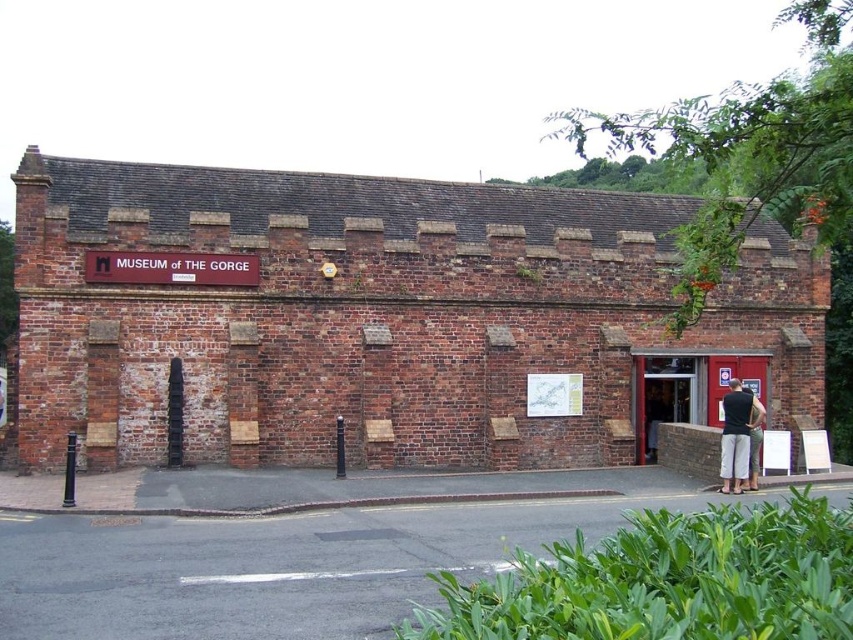
Question: Does light gray pants at center appear on the right side of dark gray fabric pants at lower right?

Choices:
 (A) yes
 (B) no

Answer: (B)

Question: Which object appears closest to the camera in this image?

Choices:
 (A) light gray pants at center
 (B) dark gray fabric pants at lower right

Answer: (A)

Question: Can you confirm if light gray pants at center is positioned above dark gray fabric pants at lower right?

Choices:
 (A) yes
 (B) no

Answer: (A)

Question: Among these objects, which one is farthest from the camera?

Choices:
 (A) dark gray fabric pants at lower right
 (B) light gray pants at center

Answer: (A)

Question: Does light gray pants at center have a lesser width compared to dark gray fabric pants at lower right?

Choices:
 (A) yes
 (B) no

Answer: (B)

Question: Which point appears farthest from the camera in this image?

Choices:
 (A) (758, 401)
 (B) (743, 410)

Answer: (A)